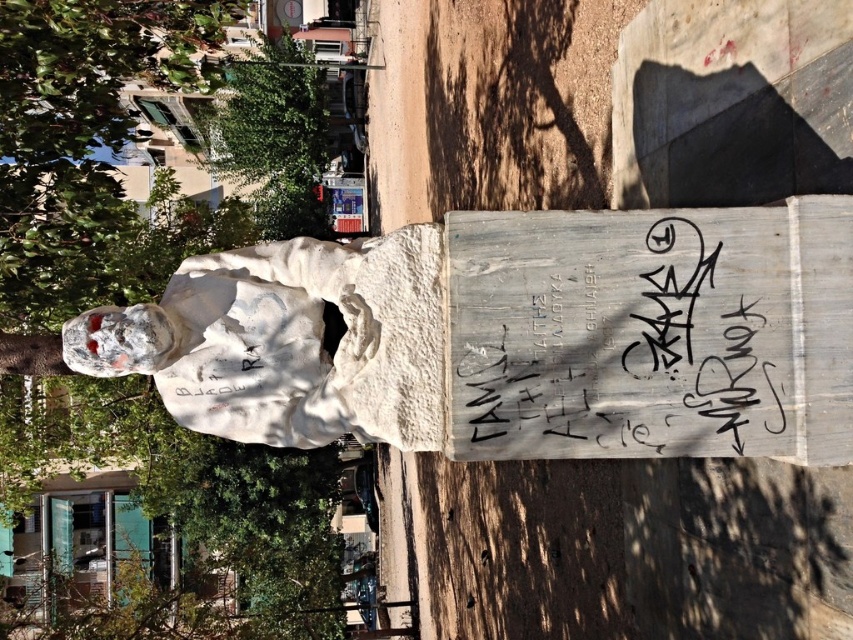
At what (x,y) coordinates should I click in order to perform the action: click on green leafy tree at upper left. Please return your answer as a coordinate pair (x, y). The height and width of the screenshot is (640, 853). Looking at the image, I should click on (134, 288).

Is green leafy tree at upper left further to camera compared to green leafy tree at upper center?

No, green leafy tree at upper left is in front of green leafy tree at upper center.

In order to click on green leafy tree at upper left in this screenshot , I will do `click(134, 288)`.

Can you confirm if green leafy tree at upper left is positioned to the right of black painted wood sign at center?

In fact, green leafy tree at upper left is to the left of black painted wood sign at center.

Does point (80, 4) lie in front of point (515, 339)?

No, it is not.

The height and width of the screenshot is (640, 853). In order to click on green leafy tree at upper left in this screenshot , I will do `click(134, 288)`.

Is black painted wood sign at center below green leafy tree at upper center?

Yes, black painted wood sign at center is below green leafy tree at upper center.

Is black painted wood sign at center to the left of green leafy tree at upper center from the viewer's perspective?

No, black painted wood sign at center is not to the left of green leafy tree at upper center.

Who is more forward, (x=561, y=452) or (x=271, y=90)?

Positioned in front is point (x=561, y=452).

Where is `black painted wood sign at center`? This screenshot has width=853, height=640. black painted wood sign at center is located at coordinates (619, 333).